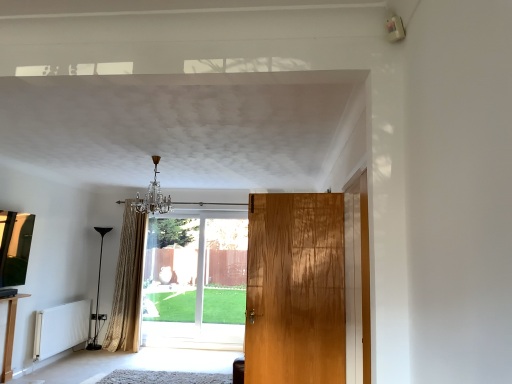
Question: Which direction should I rotate to look at clear glass door at center, marked as the second door in a right-to-left arrangement, — up or down?

Choices:
 (A) down
 (B) up

Answer: (A)

Question: Can you confirm if clear glass door at center, which ranks as the first door in left-to-right order, is wider than light brown wood table at lower left?

Choices:
 (A) yes
 (B) no

Answer: (B)

Question: From a real-world perspective, is clear glass door at center, marked as the second door in a right-to-left arrangement, over light brown wood table at lower left?

Choices:
 (A) yes
 (B) no

Answer: (A)

Question: Is clear glass door at center, marked as the second door in a right-to-left arrangement, outside of light brown wood table at lower left?

Choices:
 (A) no
 (B) yes

Answer: (B)

Question: From a real-world perspective, is clear glass door at center, positioned as the 2th door in front-to-back order, below light brown wood table at lower left?

Choices:
 (A) yes
 (B) no

Answer: (B)

Question: Can you confirm if clear glass door at center, marked as the second door in a right-to-left arrangement, is bigger than light brown wood table at lower left?

Choices:
 (A) no
 (B) yes

Answer: (B)

Question: Is clear glass door at center, marked as the second door in a right-to-left arrangement, facing away from light brown wood table at lower left?

Choices:
 (A) no
 (B) yes

Answer: (A)

Question: From a real-world perspective, is gold textured curtain at center located beneath white matte radiator at lower left?

Choices:
 (A) yes
 (B) no

Answer: (B)

Question: Could white matte radiator at lower left be considered to be inside gold textured curtain at center?

Choices:
 (A) no
 (B) yes

Answer: (A)

Question: Considering the relative sizes of gold textured curtain at center and white matte radiator at lower left in the image provided, is gold textured curtain at center wider than white matte radiator at lower left?

Choices:
 (A) yes
 (B) no

Answer: (A)

Question: From a real-world perspective, is gold textured curtain at center positioned over white matte radiator at lower left based on gravity?

Choices:
 (A) yes
 (B) no

Answer: (A)

Question: From the image's perspective, is gold textured curtain at center on white matte radiator at lower left?

Choices:
 (A) yes
 (B) no

Answer: (A)

Question: From the image's perspective, is gold textured curtain at center below white matte radiator at lower left?

Choices:
 (A) no
 (B) yes

Answer: (A)

Question: Does white matte radiator at lower left appear on the left side of clear glass door at center, which ranks as the first door in left-to-right order?

Choices:
 (A) no
 (B) yes

Answer: (B)